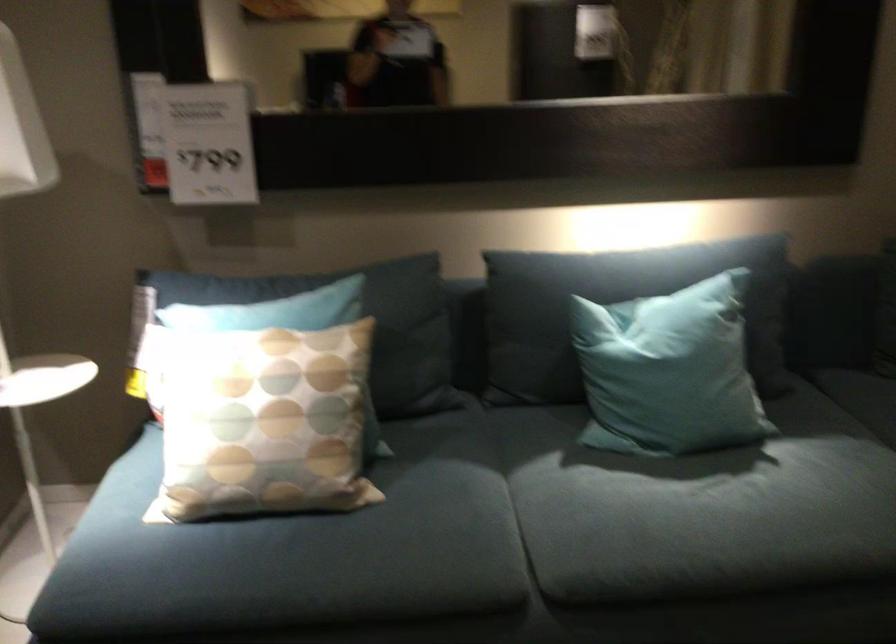
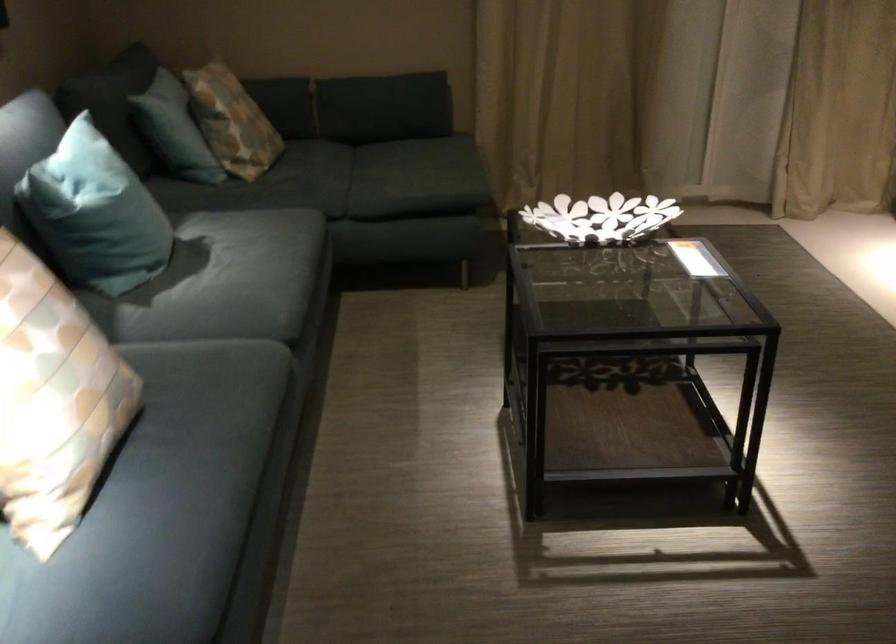
Locate, in the second image, the point that corresponds to point 291,547 in the first image.

(197, 436)